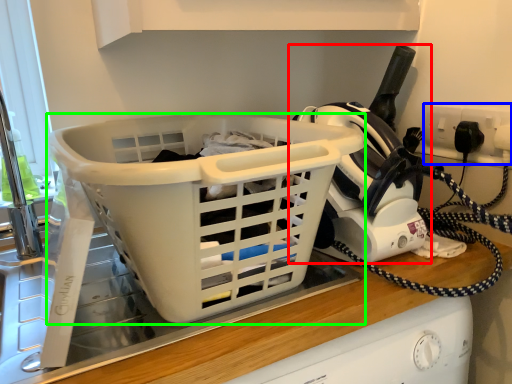
Question: Which is nearer to the appliance (highlighted by a red box)? electric outlet (highlighted by a blue box) or basket (highlighted by a green box).

Choices:
 (A) electric outlet
 (B) basket

Answer: (B)